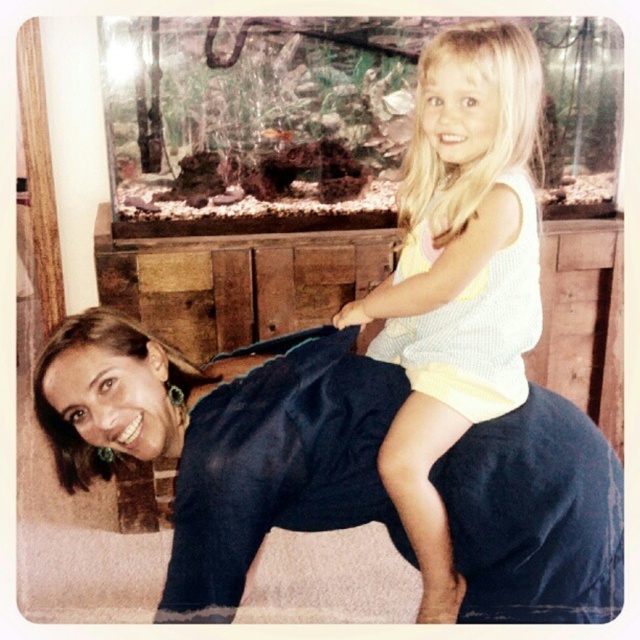
You are helping organize a costume party and need to decide which clothing item can cover more space for a group photo setup. Based on the scene, which item is wider between the dark blue fabric at center and the light yellow knit tank top at upper right?

The dark blue fabric at center is wider than the light yellow knit tank top at upper right, so it can cover more space for the group photo setup.

You are a photographer setting up for a family photoshoot. You need to position a tripod to capture both the dark blue fabric at center and the light yellow knit tank top at upper right in the same frame. The minimum distance between the two objects for the tripod to fit is 8 inches. Will the current distance allow the tripod to fit?

The distance between the dark blue fabric at center and the light yellow knit tank top at upper right is 8.72 inches, which is greater than the minimum required 8 inches. Therefore, the tripod can fit between them to capture both in the same frame.

You are a photographer setting up for a family photo shoot in the room. You need to ensure that the dark blue fabric at center and the light yellow knit tank top at upper right are both visible in the frame. Given their sizes, which item might require you to adjust your camera angle to include it properly?

The dark blue fabric at center is smaller than the light yellow knit tank top at upper right, so it might require adjusting the camera angle to ensure it is visible in the frame.